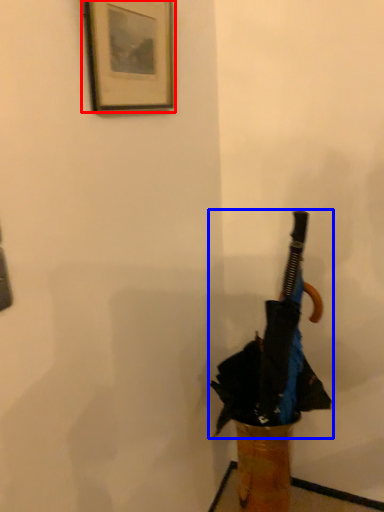
Question: Which point is further to the camera, picture frame (highlighted by a red box) or umbrella (highlighted by a blue box)?

Choices:
 (A) picture frame
 (B) umbrella

Answer: (B)